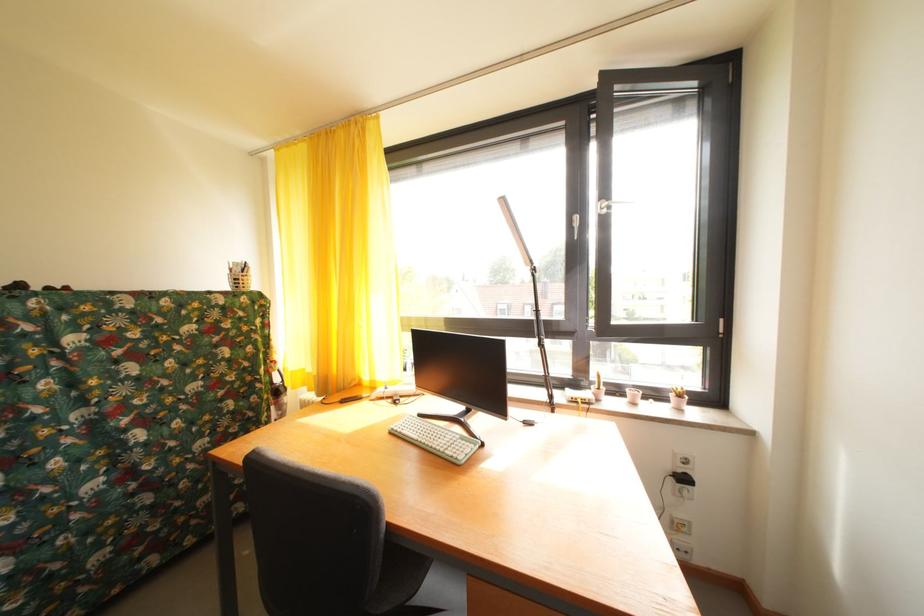
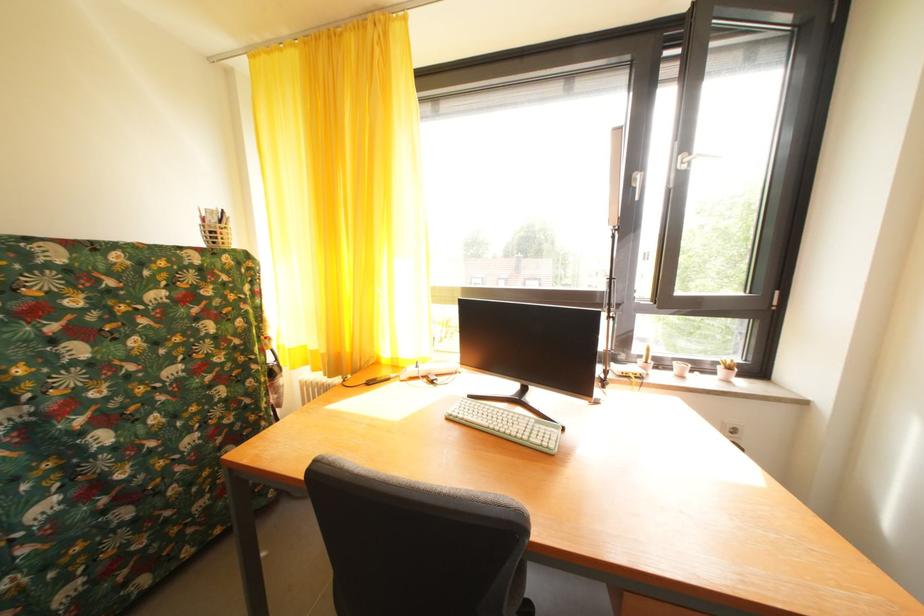
Locate, in the second image, the point that corresponds to [637,397] in the first image.

(685, 370)